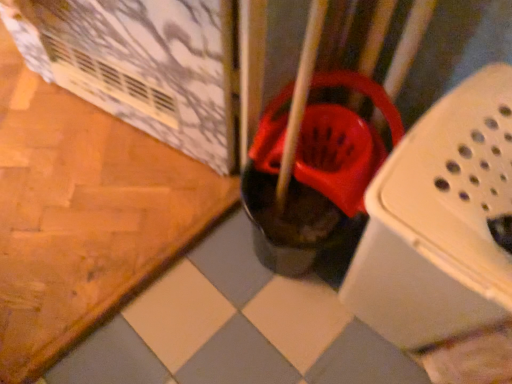
The height and width of the screenshot is (384, 512). I want to click on vacant area on top of white plastic laundry basket at center (from a real-world perspective), so click(x=466, y=160).